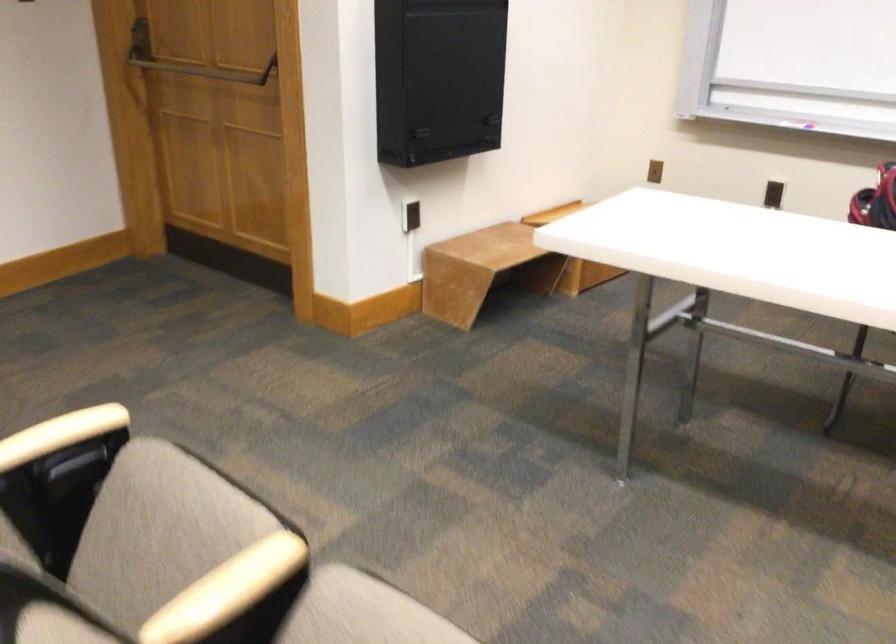
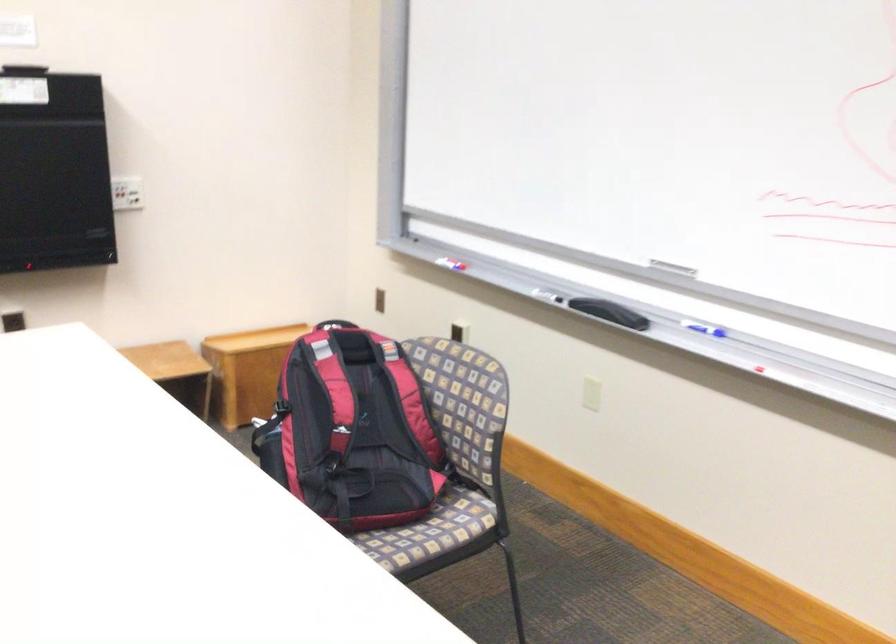
The point at (806, 108) is marked in the first image. Where is the corresponding point in the second image?

(451, 261)